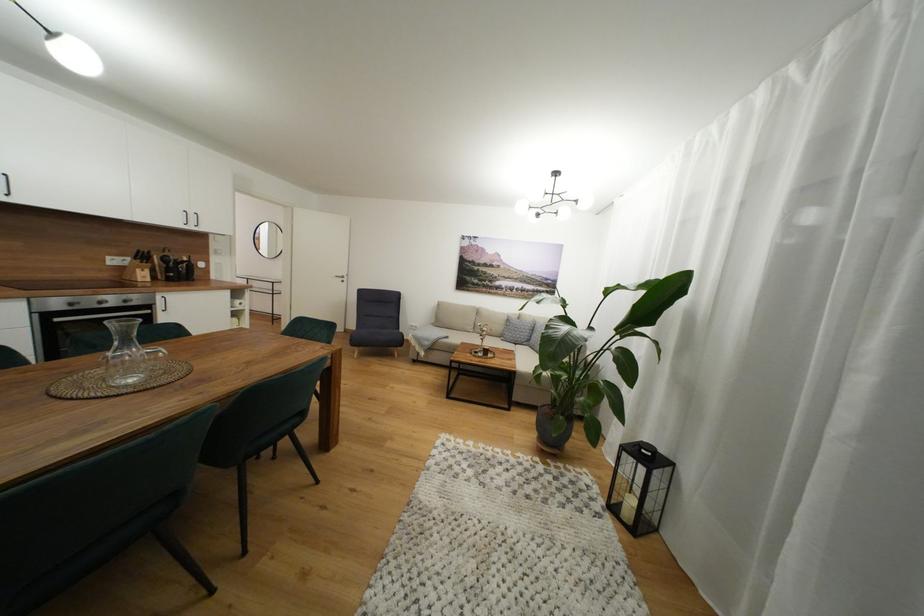
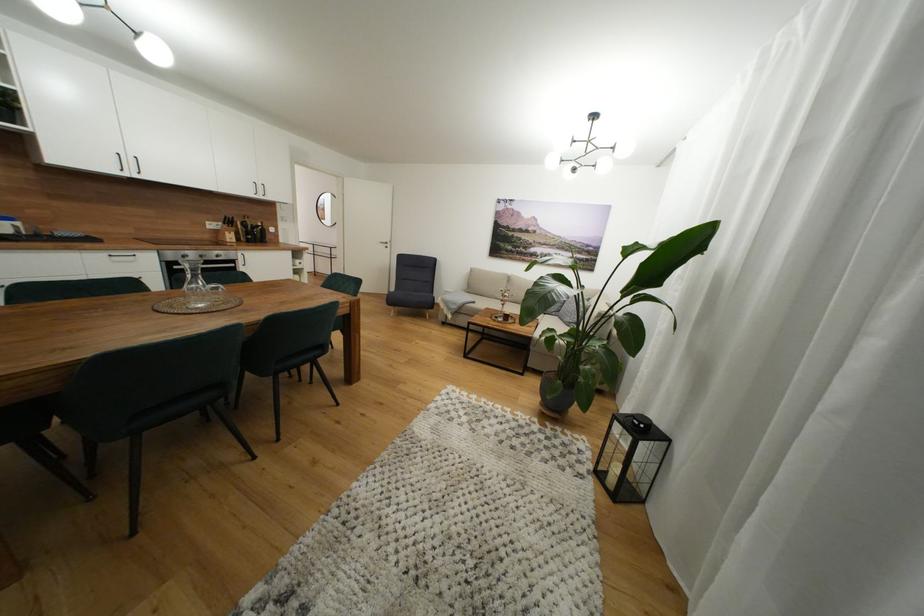
Question: The camera is either moving clockwise (left) or counter-clockwise (right) around the object. The first image is from the beginning of the video and the second image is from the end. Is the camera moving left or right when shooting the video?

Choices:
 (A) Left
 (B) Right

Answer: (B)